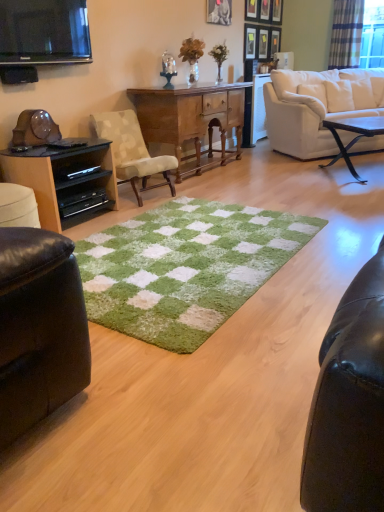
Question: From the image's perspective, is green fuzzy plant at upper center, the second houseplant when ordered from right to left, under wooden picture frame at upper center, which is the sixth picture frame from left to right?

Choices:
 (A) yes
 (B) no

Answer: (A)

Question: Is green fuzzy plant at upper center, which is the first houseplant in left-to-right order, located outside wooden picture frame at upper center, which is the 2th picture frame from right to left?

Choices:
 (A) no
 (B) yes

Answer: (B)

Question: Is green fuzzy plant at upper center, which is the first houseplant in left-to-right order, positioned in front of wooden picture frame at upper center, which is the 2th picture frame from right to left?

Choices:
 (A) yes
 (B) no

Answer: (A)

Question: Does green fuzzy plant at upper center, which is the first houseplant in left-to-right order, have a larger size compared to wooden picture frame at upper center, which is the sixth picture frame from left to right?

Choices:
 (A) no
 (B) yes

Answer: (B)

Question: Is green fuzzy plant at upper center, which is the first houseplant in left-to-right order, to the right of wooden picture frame at upper center, which is the sixth picture frame from left to right, from the viewer's perspective?

Choices:
 (A) yes
 (B) no

Answer: (B)

Question: Relative to flat screen tv at upper left, is green fuzzy plant at upper center, which is the first houseplant in left-to-right order, in front or behind?

Choices:
 (A) front
 (B) behind

Answer: (B)

Question: Looking at the image, does green fuzzy plant at upper center, which is the first houseplant in left-to-right order, seem bigger or smaller compared to flat screen tv at upper left?

Choices:
 (A) big
 (B) small

Answer: (B)

Question: Based on their positions, is green fuzzy plant at upper center, the second houseplant when ordered from right to left, located to the left or right of flat screen tv at upper left?

Choices:
 (A) right
 (B) left

Answer: (A)

Question: In terms of height, does green fuzzy plant at upper center, which is the first houseplant in left-to-right order, look taller or shorter compared to flat screen tv at upper left?

Choices:
 (A) tall
 (B) short

Answer: (B)

Question: In the image, is black glossy entertainment center at left positioned in front of or behind flat screen tv at upper left?

Choices:
 (A) behind
 (B) front

Answer: (A)

Question: Would you say black glossy entertainment center at left is inside or outside flat screen tv at upper left?

Choices:
 (A) inside
 (B) outside

Answer: (B)

Question: From a real-world perspective, is black glossy entertainment center at left physically located above or below flat screen tv at upper left?

Choices:
 (A) above
 (B) below

Answer: (B)

Question: Is black glossy entertainment center at left wider or thinner than flat screen tv at upper left?

Choices:
 (A) wide
 (B) thin

Answer: (A)

Question: Considering the positions of wooden picture frame at upper center, which is the 4th picture frame from right to left, and beige fabric chair at center in the image, is wooden picture frame at upper center, which is the 4th picture frame from right to left, taller or shorter than beige fabric chair at center?

Choices:
 (A) tall
 (B) short

Answer: (B)

Question: Considering the positions of wooden picture frame at upper center, which is the 4th picture frame from right to left, and beige fabric chair at center in the image, is wooden picture frame at upper center, which is the 4th picture frame from right to left, wider or thinner than beige fabric chair at center?

Choices:
 (A) wide
 (B) thin

Answer: (B)